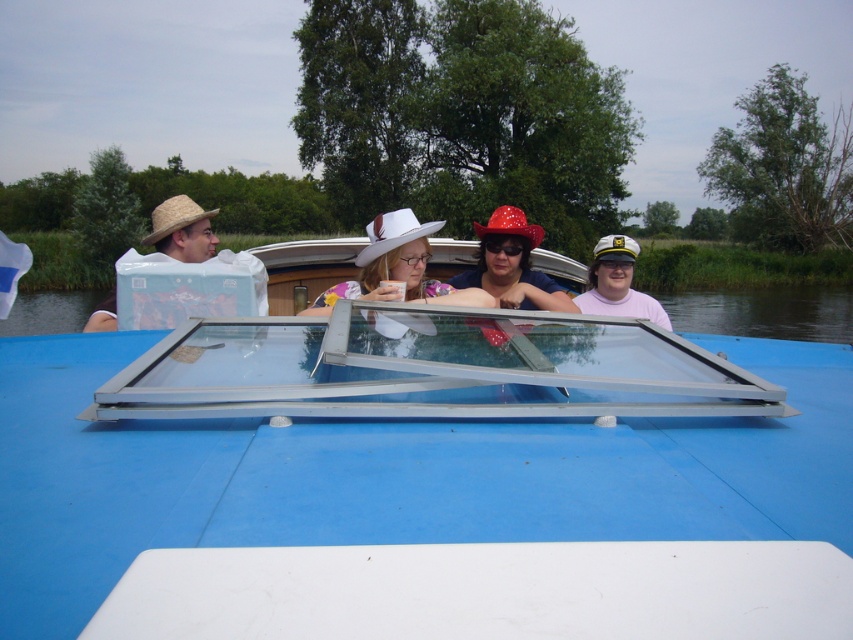
Question: Does pink matte cap at center have a larger size compared to matte straw hat at left?

Choices:
 (A) no
 (B) yes

Answer: (A)

Question: Among these points, which one is farthest from the camera?

Choices:
 (A) (627, 253)
 (B) (125, 586)
 (C) (163, 227)

Answer: (A)

Question: Which point is closer to the camera taking this photo?

Choices:
 (A) (390, 609)
 (B) (161, 246)

Answer: (A)

Question: In this image, where is transparent glass boat at center located relative to matte straw hat at left?

Choices:
 (A) left
 (B) right

Answer: (B)

Question: Among these points, which one is nearest to the camera?

Choices:
 (A) (579, 298)
 (B) (309, 627)

Answer: (B)

Question: Does transparent glass boat at center have a smaller size compared to matte straw hat at left?

Choices:
 (A) no
 (B) yes

Answer: (B)